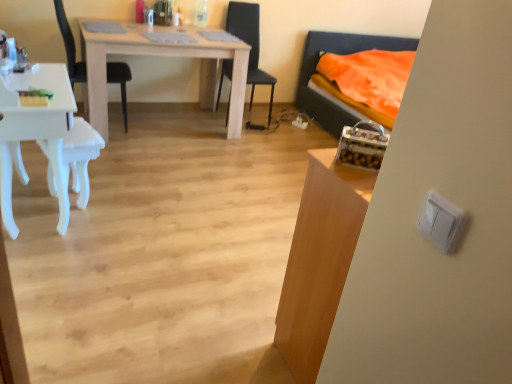
This screenshot has height=384, width=512. I want to click on vacant point to the right of white glossy armchair at lower left, so click(124, 206).